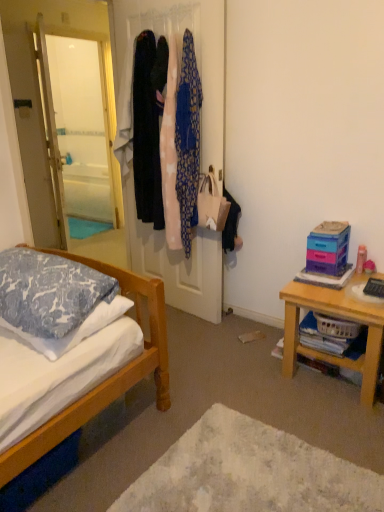
Where is `vacant space that is to the left of wooden table at right`? This screenshot has width=384, height=512. vacant space that is to the left of wooden table at right is located at coordinates (244, 370).